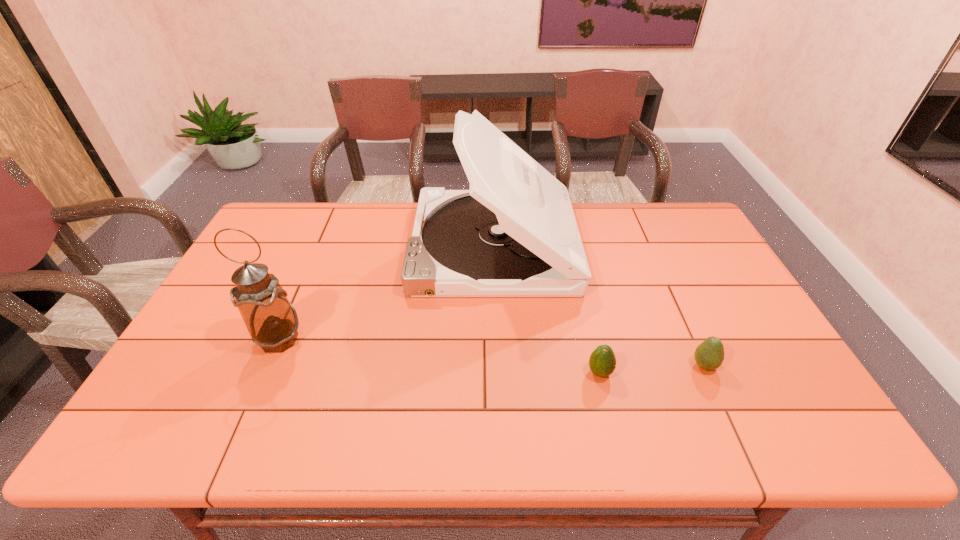
This screenshot has width=960, height=540. I want to click on object situated at the far edge, so click(x=513, y=234).

Identify the location of vacant space at the far edge. (320, 221).

I want to click on free space at the near edge, so click(x=232, y=419).

Identify the location of vacant area at the left edge. (189, 349).

Where is `vacant space at the right edge of the desktop`? Image resolution: width=960 pixels, height=540 pixels. vacant space at the right edge of the desktop is located at coordinates (725, 362).

Locate an element on the screen. The width and height of the screenshot is (960, 540). blank space at the far right corner is located at coordinates (678, 228).

Where is `blank space at the near right corner of the desktop`? This screenshot has width=960, height=540. blank space at the near right corner of the desktop is located at coordinates (760, 415).

The width and height of the screenshot is (960, 540). Identify the location of vacant area that lies between the CD player and the oil lamp. (386, 293).

Locate an element on the screen. This screenshot has height=540, width=960. vacant space in between the left avocado and the rightmost object is located at coordinates (652, 369).

At what (x,y) coordinates should I click in order to perform the action: click on free spot between the left avocado and the leftmost object. Please return your answer as a coordinate pair (x, y). This screenshot has width=960, height=540. Looking at the image, I should click on (440, 356).